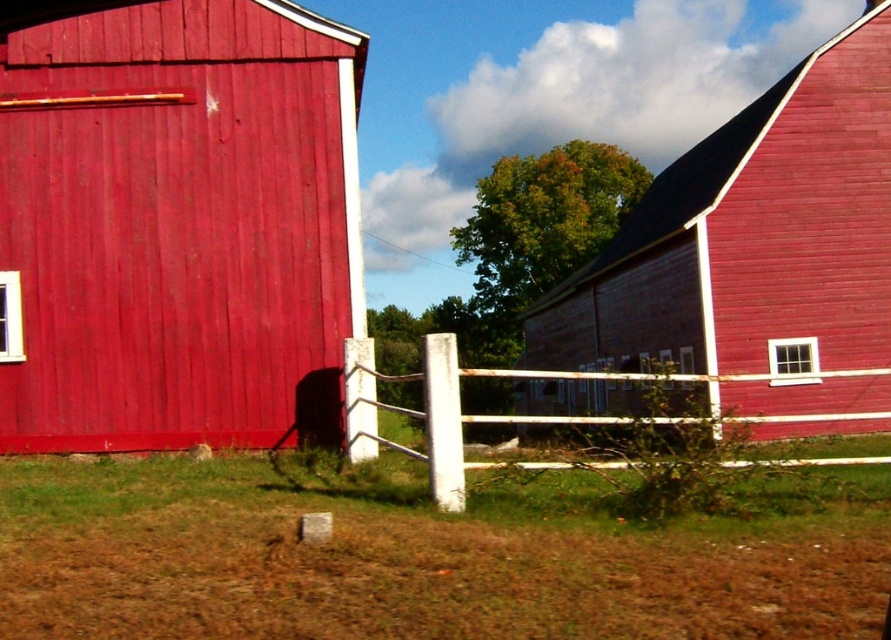
You are a painter standing at the base of the white wooden fence at center, looking towards the matte wood barn at center. Which object is higher in your field of view?

The matte wood barn at center is located above the white wooden fence at center, so it will appear higher in your field of view.

Looking at this image, you are standing in the middle of the field between the two barns and want to walk towards the smooth wooden barn at center. Which direction should you walk to avoid the white wooden fence at center first?

You should walk towards the smooth wooden barn at center directly, as it is closer to you than the white wooden fence at center, so you will reach the barn before encountering the fence.

You are standing at the origin point in the scene. Which direction should you move to reach the matte wood barn at center?

The matte wood barn at center is located at point 0.353 on the x and 0.202 on the y, so you should move northeast to reach it.